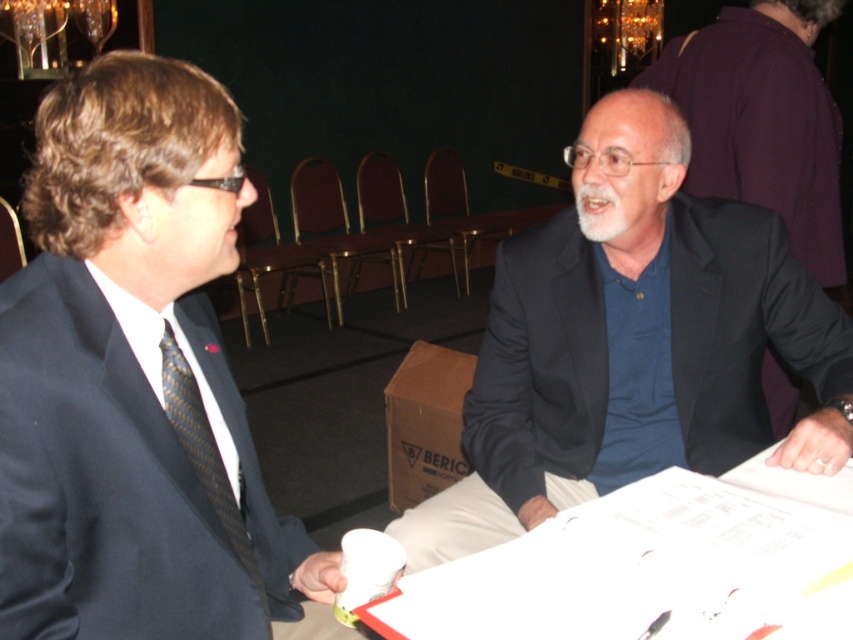
You are standing in the room and want to walk from point (x=607, y=515) to point (x=216, y=467). Which direction should you move in relative to your current position?

You should move downward and to the left because point (x=216, y=467) is located lower and to the left of point (x=607, y=515).

Based on the photo, based on the scene description, which object is larger in size between the white paper at center and the black striped tie at left?

The white paper at center is bigger than the black striped tie at left.

You are standing in the room and notice a specific point marked at coordinates point (125, 54). If you want to place a 32 inch wide table in front of this point, will there be enough space?

The point (125, 54) is 33.99 inches away from the viewer. Since the table is 32 inches wide, there is enough space as the distance is greater than the table width.